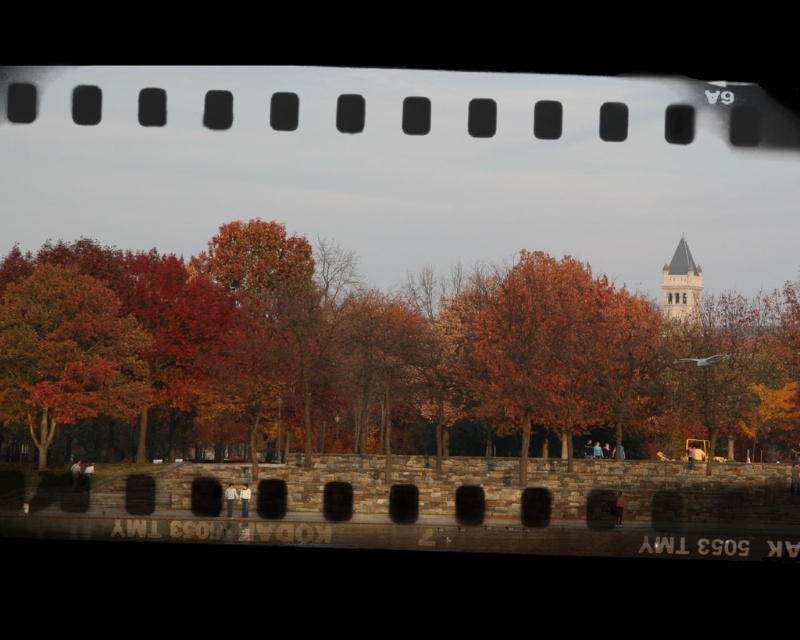
Question: Is autumn leaves at center thinner than smooth white stone bell tower at upper right?

Choices:
 (A) no
 (B) yes

Answer: (A)

Question: Where is autumn leaves at center located in relation to smooth white stone bell tower at upper right in the image?

Choices:
 (A) right
 (B) left

Answer: (B)

Question: Which object is farther from the camera taking this photo?

Choices:
 (A) smooth white stone bell tower at upper right
 (B) autumn leaves at center

Answer: (A)

Question: Among these points, which one is nearest to the camera?

Choices:
 (A) (96, 442)
 (B) (688, 282)

Answer: (B)

Question: Does autumn leaves at center have a greater width compared to smooth white stone bell tower at upper right?

Choices:
 (A) no
 (B) yes

Answer: (B)